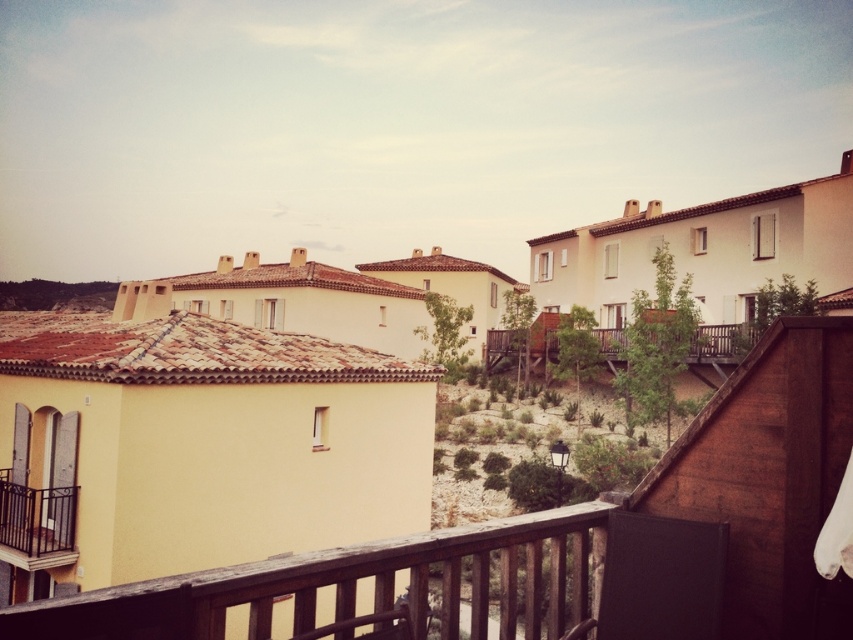
Does wooden at center appear on the right side of black wrought iron balcony at lower left?

Indeed, wooden at center is positioned on the right side of black wrought iron balcony at lower left.

Between wooden at center and black wrought iron balcony at lower left, which one appears on the left side from the viewer's perspective?

black wrought iron balcony at lower left

In order to click on wooden at center in this screenshot , I will do `click(523, 342)`.

Does wooden at lower center have a lesser width compared to black wrought iron balcony at lower left?

No, wooden at lower center is not thinner than black wrought iron balcony at lower left.

Can you confirm if wooden at lower center is bigger than black wrought iron balcony at lower left?

Indeed, wooden at lower center has a larger size compared to black wrought iron balcony at lower left.

Is point (583, 509) closer to camera compared to point (67, 554)?

Yes.

The image size is (853, 640). Identify the location of wooden at lower center. (352, 588).

Looking at this image, does wooden at lower center have a larger size compared to wooden at center?

Correct, wooden at lower center is larger in size than wooden at center.

Is wooden at lower center closer to the viewer compared to wooden at center?

Yes, it is in front of wooden at center.

Is point (534, 570) less distant than point (532, 362)?

Yes.

This screenshot has width=853, height=640. Find the location of `wooden at lower center`. wooden at lower center is located at coordinates (352, 588).